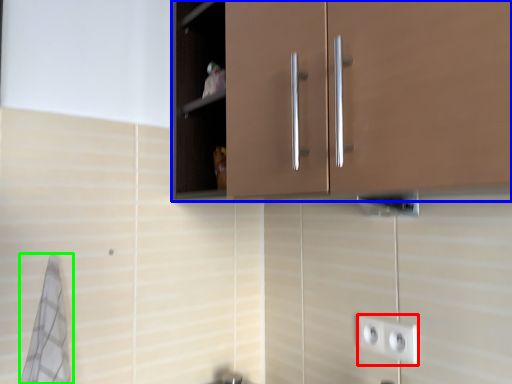
Question: Which is farther away from socket (highlighted by a red box)? cabinetry (highlighted by a blue box) or bath towel (highlighted by a green box)?

Choices:
 (A) cabinetry
 (B) bath towel

Answer: (B)